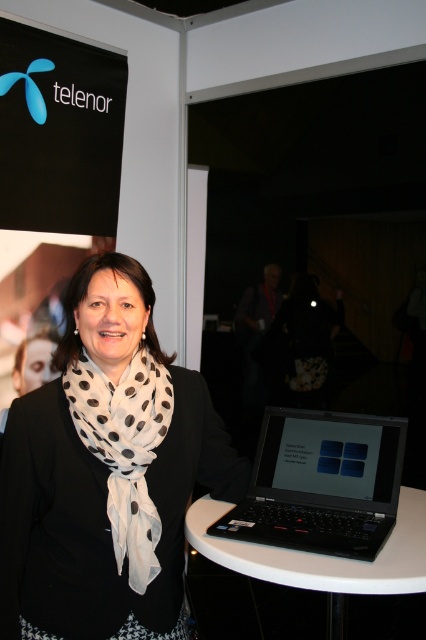
Who is positioned more to the right, white dotted scarf at center or white glossy round table at center?

white glossy round table at center is more to the right.

Identify the location of white dotted scarf at center. This screenshot has height=640, width=426. (104, 468).

Is point (118, 595) in front of point (270, 577)?

Yes, it is.

Locate an element on the screen. white dotted scarf at center is located at coordinates (104, 468).

What do you see at coordinates (322, 484) in the screenshot?
I see `black matte laptop at lower right` at bounding box center [322, 484].

Which is behind, point (270, 536) or point (80, 419)?

Positioned behind is point (270, 536).

You are a GUI agent. You are given a task and a screenshot of the screen. Output one action in this format:
    pyautogui.click(x=<x>, y=<y>)
    Task: Click on the black matte laptop at lower right
    The height and width of the screenshot is (640, 426).
    Given the screenshot: What is the action you would take?
    pyautogui.click(x=322, y=484)

Who is higher up, white glossy round table at center or white sheer scarf at center?

white sheer scarf at center

From the picture: Who is taller, white glossy round table at center or white sheer scarf at center?

Standing taller between the two is white sheer scarf at center.

Identify the location of white glossy round table at center. (302, 580).

Find the location of a particular element. This screenshot has width=426, height=640. white glossy round table at center is located at coordinates (302, 580).